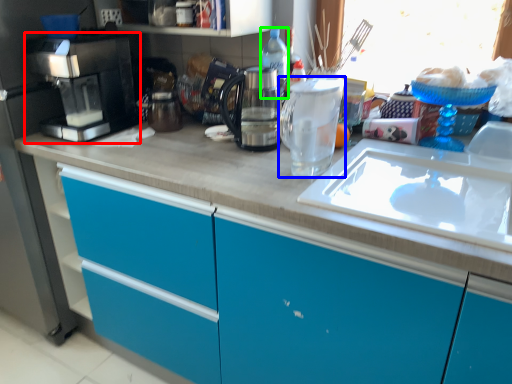
Question: Which object is positioned farthest from home appliance (highlighted by a red box)? Select from kitchen appliance (highlighted by a blue box) and bottle (highlighted by a green box).

Choices:
 (A) kitchen appliance
 (B) bottle

Answer: (A)